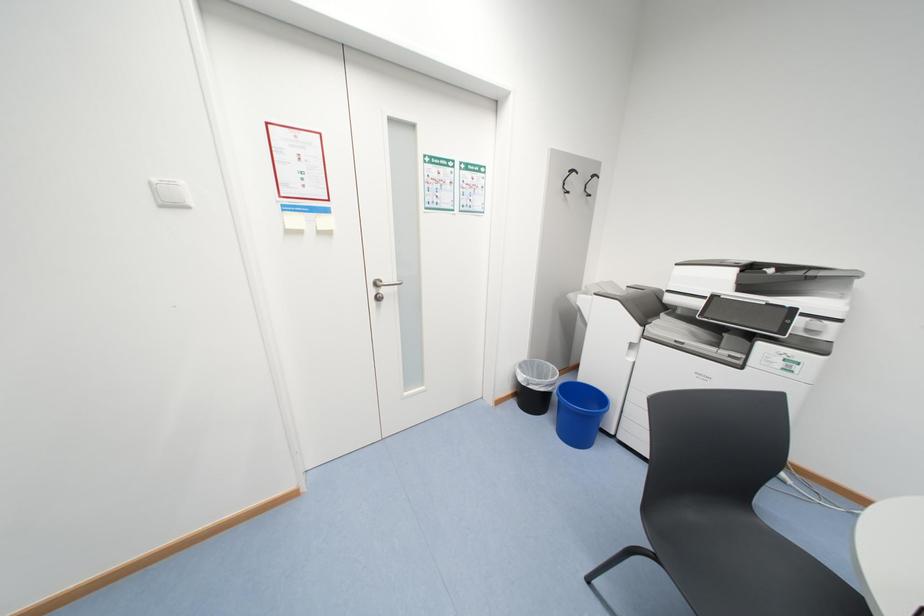
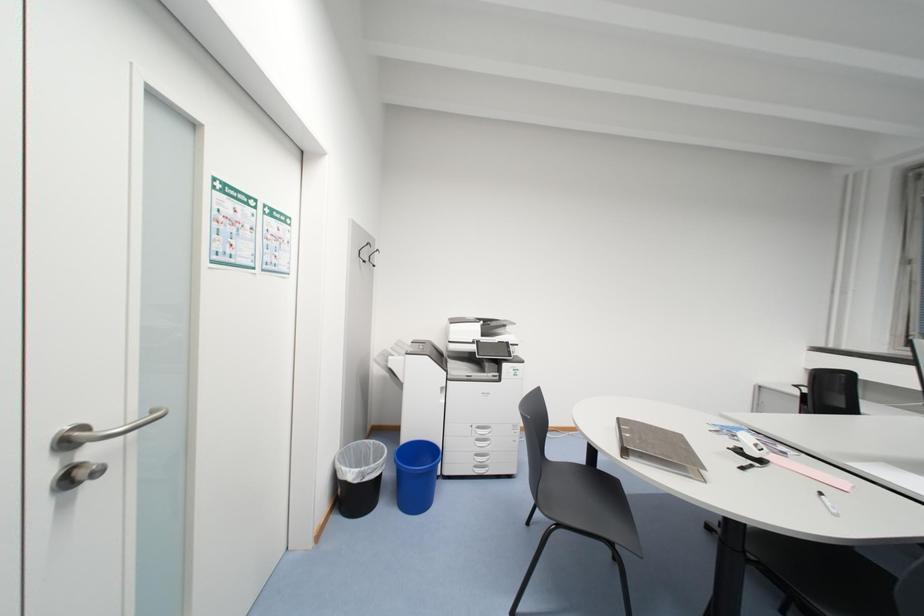
Question: The images are taken continuously from a first-person perspective. In which direction is your viewpoint rotating?

Choices:
 (A) Left
 (B) Right
 (C) Up
 (D) Down

Answer: (B)